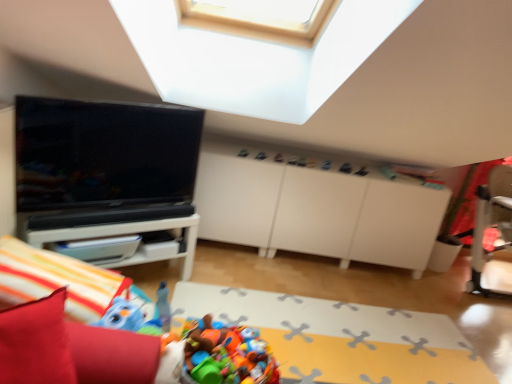
Question: From the image's perspective, is matte black toy at upper center, the third toy positioned from the front, above white glossy table at left?

Choices:
 (A) no
 (B) yes

Answer: (B)

Question: Is matte black toy at upper center, the 3th toy when ordered from left to right, far away from white glossy table at left?

Choices:
 (A) yes
 (B) no

Answer: (A)

Question: Is white glossy table at left a part of matte black toy at upper center, the third toy positioned from the front?

Choices:
 (A) no
 (B) yes

Answer: (A)

Question: From a real-world perspective, is matte black toy at upper center, the 3th toy when ordered from left to right, on white glossy table at left?

Choices:
 (A) no
 (B) yes

Answer: (B)

Question: Can you confirm if matte black toy at upper center, the 3th toy when ordered from left to right, is bigger than white glossy table at left?

Choices:
 (A) no
 (B) yes

Answer: (A)

Question: From the image's perspective, is plastic colorful toys at lower center, the third toy when ordered from top to bottom, positioned above or below white glossy table at left?

Choices:
 (A) below
 (B) above

Answer: (A)

Question: In the image, is plastic colorful toys at lower center, marked as the 1th toy in a left-to-right arrangement, on the left side or the right side of white glossy table at left?

Choices:
 (A) right
 (B) left

Answer: (A)

Question: Would you say plastic colorful toys at lower center, which ranks as the 1th toy in front-to-back order, is inside or outside white glossy table at left?

Choices:
 (A) outside
 (B) inside

Answer: (A)

Question: From a real-world perspective, is plastic colorful toys at lower center, the 3th toy when ordered from back to front, positioned above or below white glossy table at left?

Choices:
 (A) above
 (B) below

Answer: (B)

Question: From their relative heights in the image, would you say matte plastic toy at upper center, which is the second toy from front to back, is taller or shorter than matte black toy at upper center, acting as the 1th toy starting from the right?

Choices:
 (A) short
 (B) tall

Answer: (A)

Question: Considering the positions of point (279, 153) and point (351, 165), is point (279, 153) closer or farther from the camera than point (351, 165)?

Choices:
 (A) farther
 (B) closer

Answer: (B)

Question: From a real-world perspective, is matte plastic toy at upper center, acting as the 3th toy starting from the bottom, physically located above or below matte black toy at upper center, the second toy in the bottom-to-top sequence?

Choices:
 (A) below
 (B) above

Answer: (B)

Question: Based on their sizes in the image, would you say matte plastic toy at upper center, which is the second toy from front to back, is bigger or smaller than matte black toy at upper center, acting as the 1th toy starting from the right?

Choices:
 (A) big
 (B) small

Answer: (B)

Question: Would you say plastic colorful toys at lower center, marked as the 1th toy in a left-to-right arrangement, is to the left or to the right of plastic toy basket at lower center in the picture?

Choices:
 (A) left
 (B) right

Answer: (A)

Question: Relative to plastic toy basket at lower center, is plastic colorful toys at lower center, which is counted as the first toy, starting from the bottom, in front or behind?

Choices:
 (A) front
 (B) behind

Answer: (A)